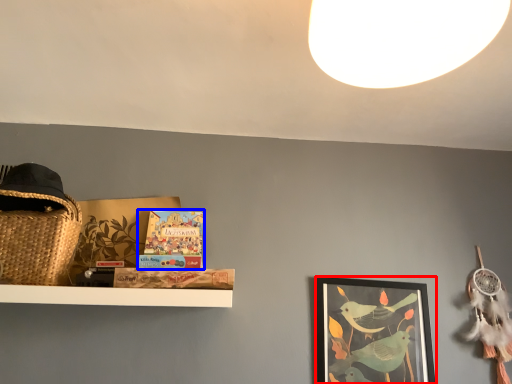
Question: Among these objects, which one is farthest to the camera, picture frame (highlighted by a red box) or book (highlighted by a blue box)?

Choices:
 (A) picture frame
 (B) book

Answer: (A)